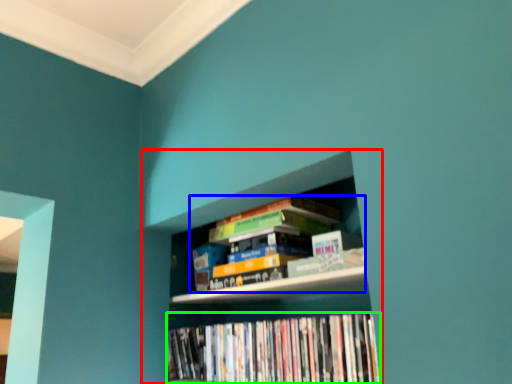
Question: Which is nearer to the bookcase (highlighted by a red box)? book (highlighted by a blue box) or book (highlighted by a green box).

Choices:
 (A) book
 (B) book

Answer: (B)